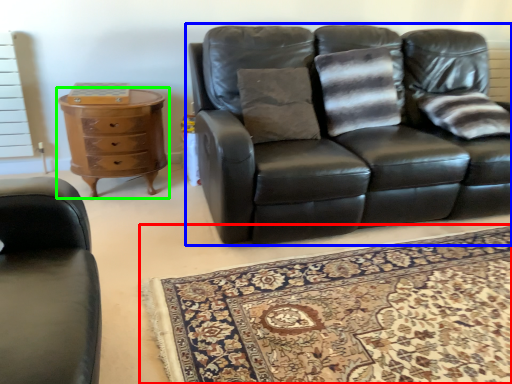
Question: Estimate the real-world distances between objects in this image. Which object is farther from mat (highlighted by a red box), studio couch (highlighted by a blue box) or chest of drawers (highlighted by a green box)?

Choices:
 (A) studio couch
 (B) chest of drawers

Answer: (B)